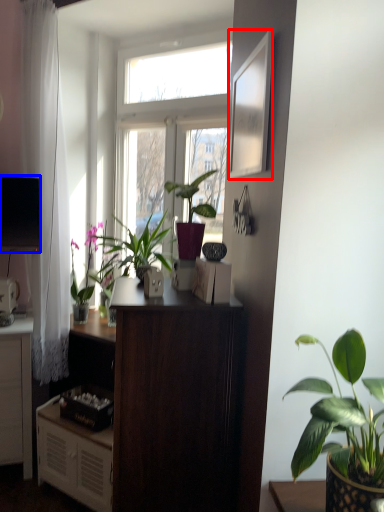
Question: Which object is closer to the camera taking this photo, picture frame (highlighted by a red box) or television (highlighted by a blue box)?

Choices:
 (A) picture frame
 (B) television

Answer: (A)